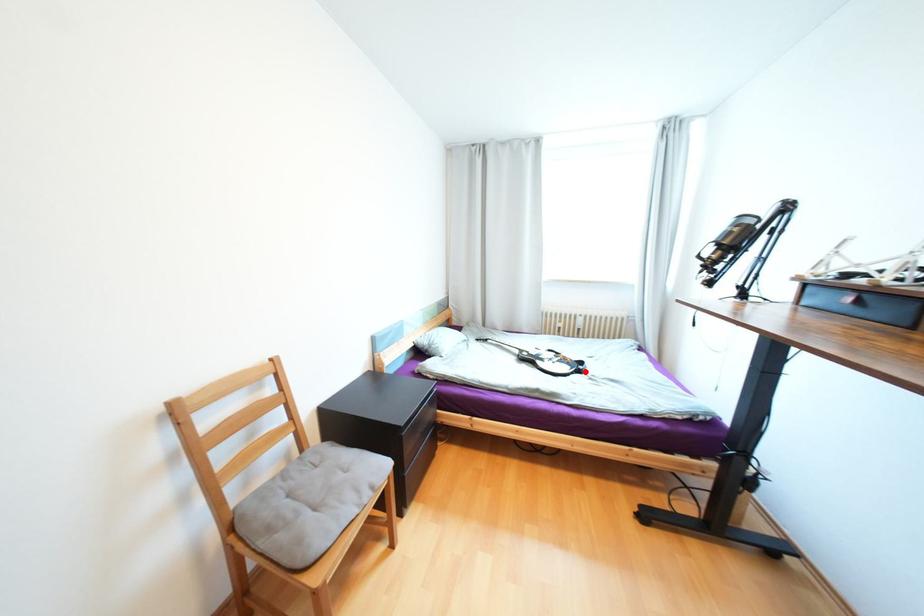
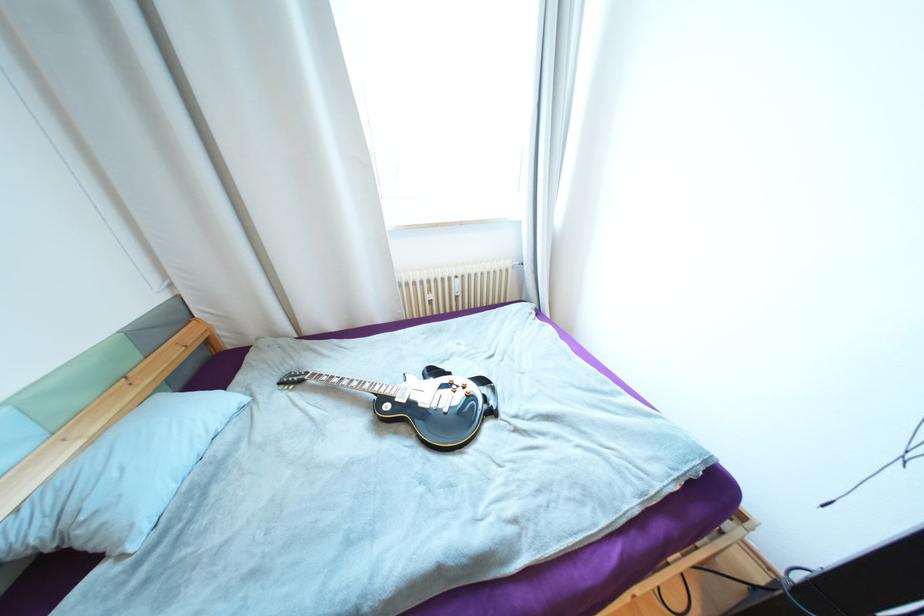
In the second image, find the point that corresponds to the highlighted location in the first image.

(497, 413)